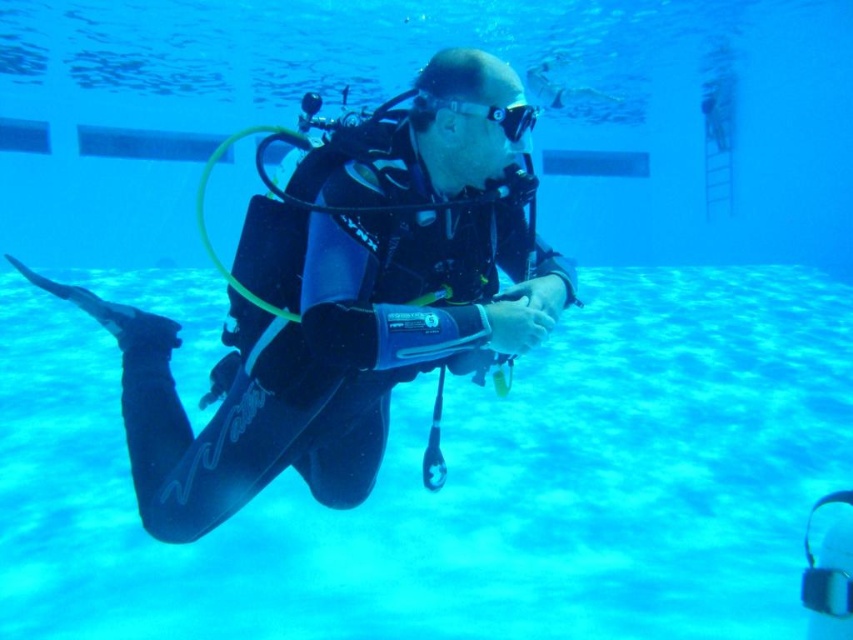
Question: Can you confirm if blue matte swimming pool at center is positioned above transparent rubber goggles at center?

Choices:
 (A) yes
 (B) no

Answer: (B)

Question: Which of the following is the closest to the observer?

Choices:
 (A) transparent rubber goggles at center
 (B) black matte scuba diver at center

Answer: (B)

Question: Estimate the real-world distances between objects in this image. Which object is closer to the transparent rubber goggles at center?

Choices:
 (A) black matte scuba diver at center
 (B) blue matte swimming pool at center

Answer: (A)

Question: Does black matte scuba diver at center appear over transparent rubber goggles at center?

Choices:
 (A) yes
 (B) no

Answer: (B)

Question: Is blue matte swimming pool at center to the left of black matte scuba diver at center from the viewer's perspective?

Choices:
 (A) yes
 (B) no

Answer: (B)

Question: Which point is farther from the camera taking this photo?

Choices:
 (A) (577, 561)
 (B) (173, 451)

Answer: (A)